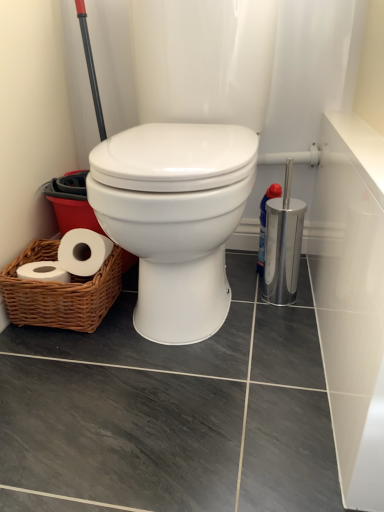
Question: Is white glossy toilet at center shorter than woven brown basket at lower left?

Choices:
 (A) no
 (B) yes

Answer: (A)

Question: Considering the relative positions of white glossy toilet at center and woven brown basket at lower left in the image provided, is white glossy toilet at center behind woven brown basket at lower left?

Choices:
 (A) yes
 (B) no

Answer: (B)

Question: Considering the relative sizes of white glossy toilet at center and woven brown basket at lower left in the image provided, is white glossy toilet at center bigger than woven brown basket at lower left?

Choices:
 (A) yes
 (B) no

Answer: (A)

Question: Is white glossy toilet at center outside woven brown basket at lower left?

Choices:
 (A) no
 (B) yes

Answer: (B)

Question: Considering the relative sizes of white glossy toilet at center and woven brown basket at lower left in the image provided, is white glossy toilet at center smaller than woven brown basket at lower left?

Choices:
 (A) no
 (B) yes

Answer: (A)

Question: Is white glossy toilet at center far away from woven brown basket at lower left?

Choices:
 (A) no
 (B) yes

Answer: (A)

Question: Considering the relative sizes of woven brown basket at lower left and white glossy toilet at center in the image provided, is woven brown basket at lower left wider than white glossy toilet at center?

Choices:
 (A) no
 (B) yes

Answer: (A)

Question: Is there a large distance between woven brown basket at lower left and white glossy toilet at center?

Choices:
 (A) yes
 (B) no

Answer: (B)

Question: From a real-world perspective, is woven brown basket at lower left under white glossy toilet at center?

Choices:
 (A) no
 (B) yes

Answer: (B)

Question: From the image's perspective, is woven brown basket at lower left under white glossy toilet at center?

Choices:
 (A) yes
 (B) no

Answer: (A)

Question: Is woven brown basket at lower left taller than white glossy toilet at center?

Choices:
 (A) no
 (B) yes

Answer: (A)

Question: Can you confirm if woven brown basket at lower left is positioned to the right of white glossy toilet at center?

Choices:
 (A) no
 (B) yes

Answer: (A)

Question: Is white glossy toilet at center inside the boundaries of woven brown basket at lower left, or outside?

Choices:
 (A) inside
 (B) outside

Answer: (B)